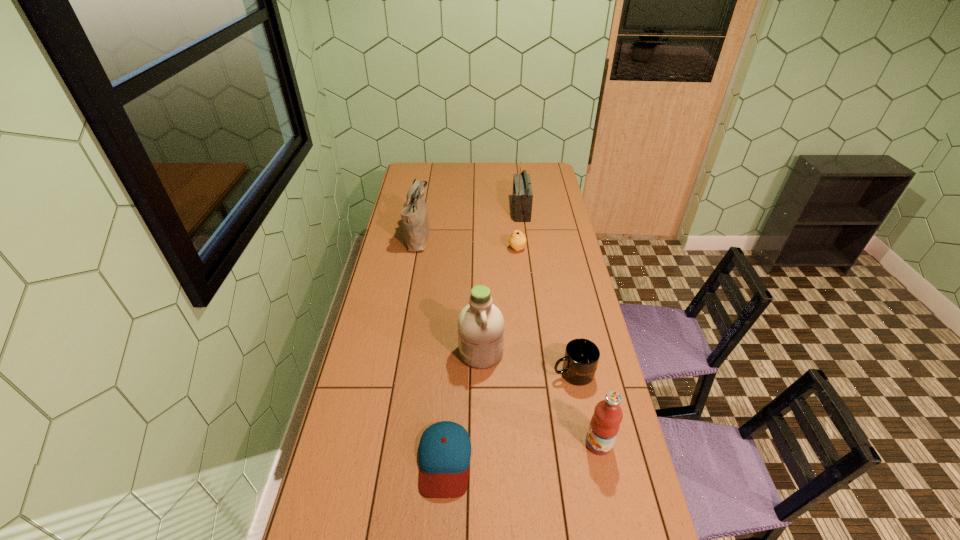
Locate an element on the screen. vacant space situated 0.070m on the back of the pear is located at coordinates (516, 235).

Identify the location of vacant area situated 0.080m with the bill of the shortest object facing forward. (440, 531).

Find the location of a particular element. object that is positioned at the left edge is located at coordinates (414, 216).

Where is `fruit juice at the right edge`? The width and height of the screenshot is (960, 540). fruit juice at the right edge is located at coordinates (605, 423).

Image resolution: width=960 pixels, height=540 pixels. I want to click on mug that is at the right edge, so click(581, 358).

Where is `vacant space at the far edge of the desktop`? This screenshot has width=960, height=540. vacant space at the far edge of the desktop is located at coordinates (440, 178).

In the image, there is a desktop. What are the coordinates of `vacant space at the left edge` in the screenshot? It's located at (356, 520).

In the image, there is a desktop. Where is `vacant space at the right edge`? vacant space at the right edge is located at coordinates (x=620, y=538).

Where is `free space at the far right corner`? The height and width of the screenshot is (540, 960). free space at the far right corner is located at coordinates coord(556,175).

The height and width of the screenshot is (540, 960). In order to click on vacant area between the fruit juice and the radio receiver in this screenshot , I will do point(560,327).